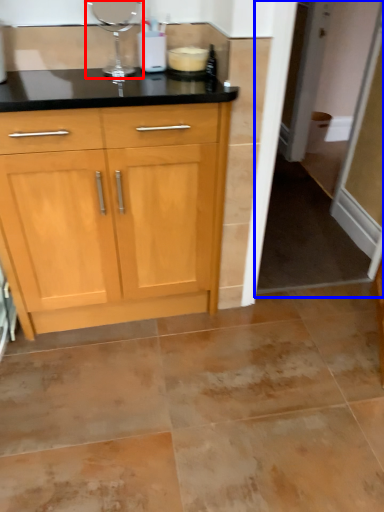
Question: Which of the following is the farthest to the observer, appliance (highlighted by a red box) or screen door (highlighted by a blue box)?

Choices:
 (A) appliance
 (B) screen door

Answer: (B)